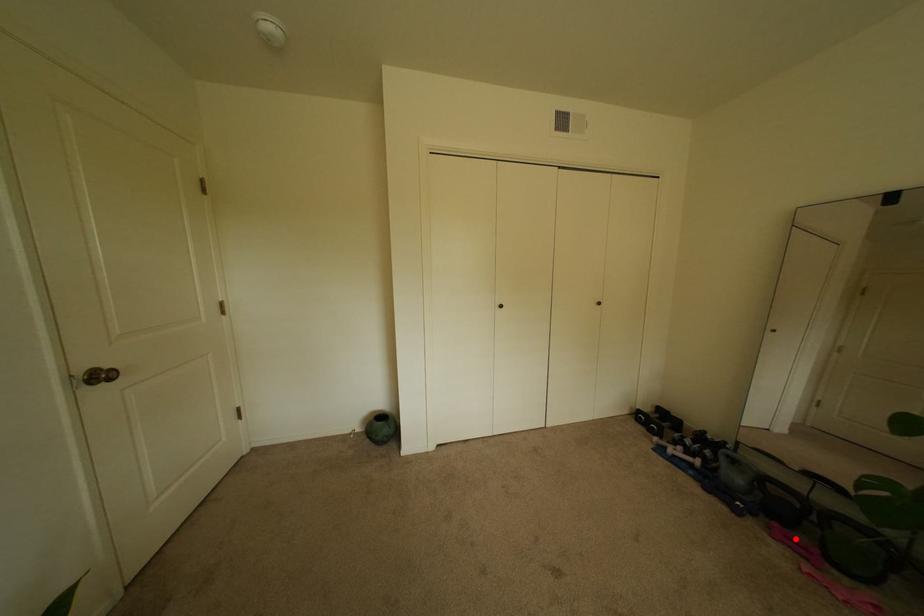
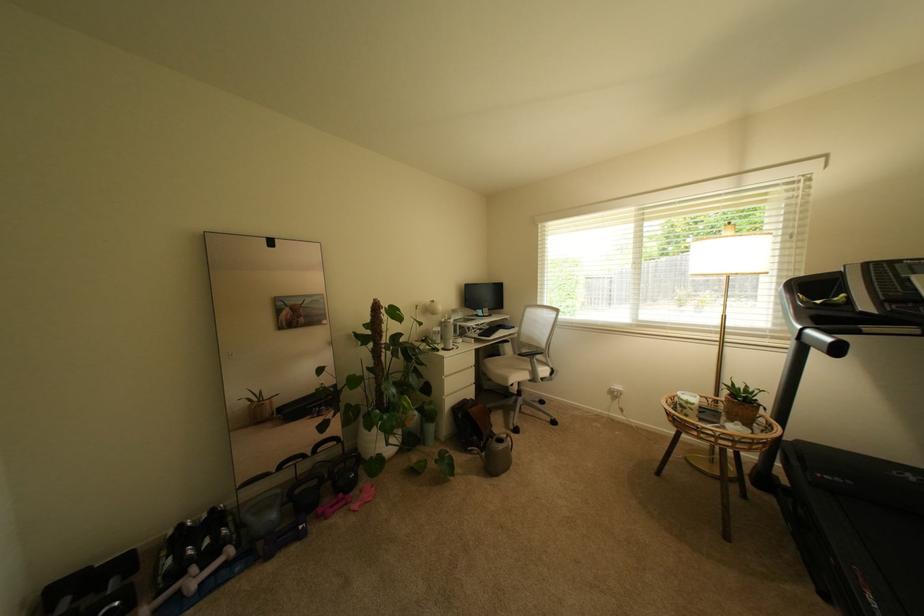
Locate, in the second image, the point that corresponds to the highlighted location in the first image.

(339, 508)